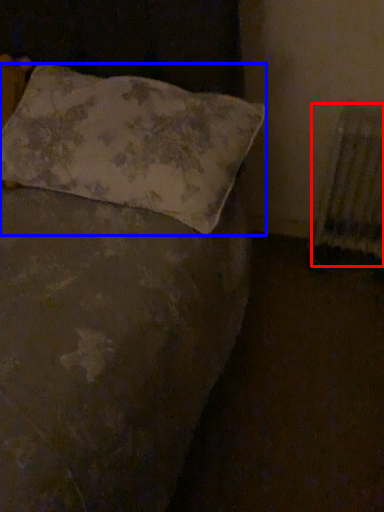
Question: Which of the following is the closest to the observer, radiator (highlighted by a red box) or pillow (highlighted by a blue box)?

Choices:
 (A) radiator
 (B) pillow

Answer: (B)